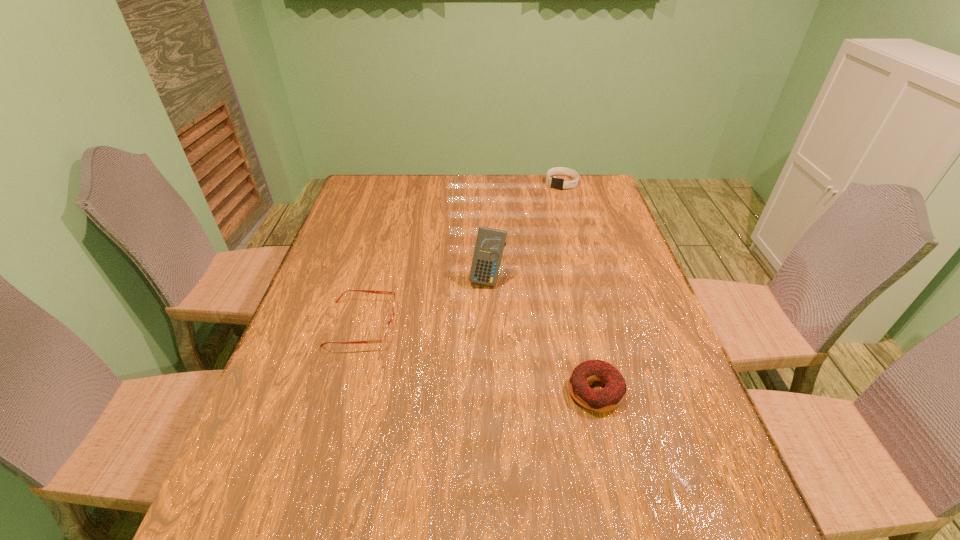
The height and width of the screenshot is (540, 960). Find the location of `vacant space at the near edge of the desktop`. vacant space at the near edge of the desktop is located at coordinates (506, 471).

Where is `vacant space at the left edge of the desktop`? Image resolution: width=960 pixels, height=540 pixels. vacant space at the left edge of the desktop is located at coordinates (354, 218).

The image size is (960, 540). In the image, there is a desktop. What are the coordinates of `vacant space at the right edge` in the screenshot? It's located at (660, 397).

Locate an element on the screen. This screenshot has height=540, width=960. vacant region at the far right corner is located at coordinates (581, 179).

Identify the location of free space between the tallest object and the wristband. (524, 231).

Find the location of `free space between the doughnut and the farthest object`. free space between the doughnut and the farthest object is located at coordinates [579, 287].

Identify the location of empty space between the spectacles and the wristband. The width and height of the screenshot is (960, 540). (x=462, y=253).

I want to click on free space that is in between the wristband and the tallest object, so 524,231.

You are a GUI agent. You are given a task and a screenshot of the screen. Output one action in this format:
    pyautogui.click(x=<x>, y=<y>)
    Task: Click on the vacant space in between the doughnut and the third farthest object
    This screenshot has width=960, height=540.
    Given the screenshot: What is the action you would take?
    pyautogui.click(x=479, y=357)

Image resolution: width=960 pixels, height=540 pixels. Find the location of `free space between the calculator and the nearest object`. free space between the calculator and the nearest object is located at coordinates (541, 335).